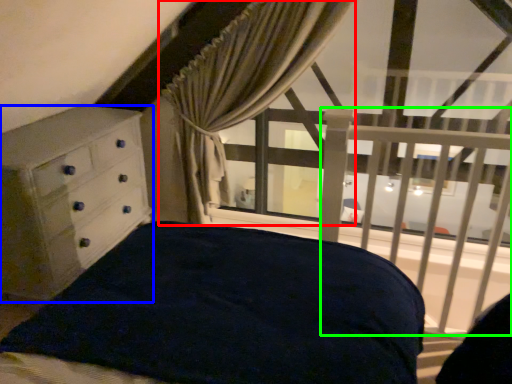
Question: Considering the real-world distances, which object is farthest from curtain (highlighted by a red box)? chest of drawers (highlighted by a blue box) or balustrade (highlighted by a green box)?

Choices:
 (A) chest of drawers
 (B) balustrade

Answer: (B)